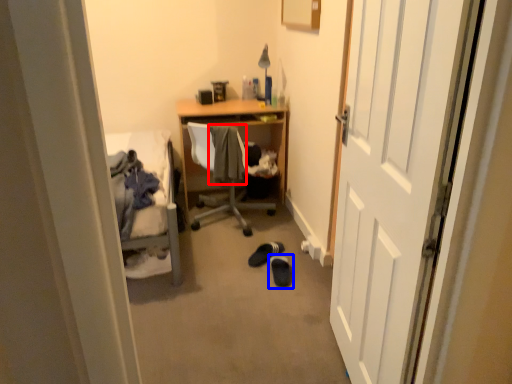
Question: Which of the following is the farthest to the observer, clothing (highlighted by a red box) or footwear (highlighted by a blue box)?

Choices:
 (A) clothing
 (B) footwear

Answer: (A)